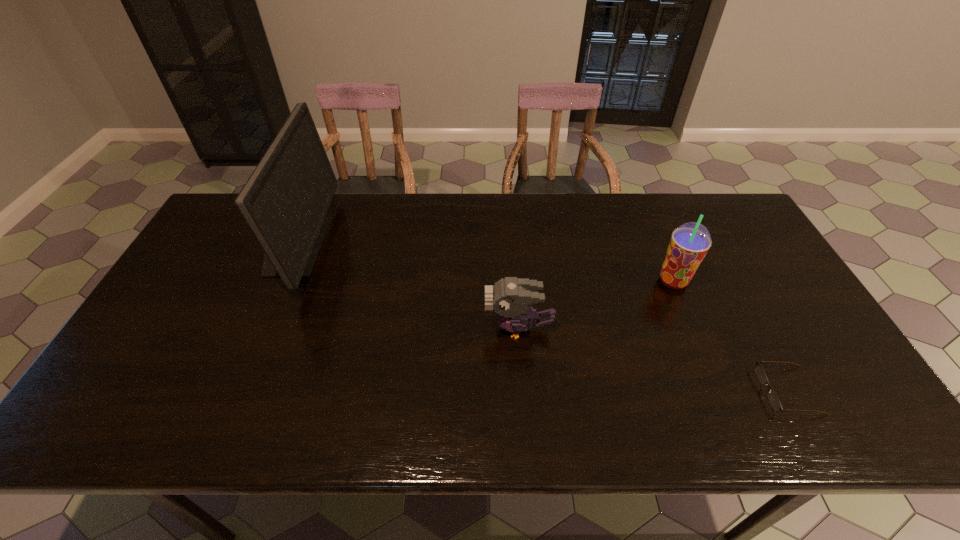
This screenshot has height=540, width=960. What are the coordinates of `free space located 0.210m at the beak of the second object from left to right` in the screenshot? It's located at (404, 329).

At what (x,y) coordinates should I click in order to perform the action: click on free region located at the beak of the second object from left to right. Please return your answer as a coordinate pair (x, y). Image resolution: width=960 pixels, height=540 pixels. Looking at the image, I should click on (396, 329).

Where is `vacant space located 0.070m at the beak of the second object from left to right`? vacant space located 0.070m at the beak of the second object from left to right is located at coordinates (458, 329).

Find the location of a particular element. The width and height of the screenshot is (960, 540). vacant space located 0.220m on the front-facing side of the shortest object is located at coordinates 669,390.

Find the location of a particular element. This screenshot has height=540, width=960. vacant space located on the front-facing side of the shortest object is located at coordinates (643, 390).

The width and height of the screenshot is (960, 540). I want to click on vacant point located 0.200m on the front-facing side of the shortest object, so click(678, 390).

At what (x,y) coordinates should I click in order to perform the action: click on object present at the far edge. Please return your answer as a coordinate pair (x, y). This screenshot has height=540, width=960. Looking at the image, I should click on (285, 201).

Identify the location of object that is positioned at the near edge. This screenshot has height=540, width=960. (759, 371).

You are a GUI agent. You are given a task and a screenshot of the screen. Output one action in this format:
    pyautogui.click(x=<x>, y=<y>)
    Task: Click on the object that is at the right edge
    Image resolution: width=960 pixels, height=540 pixels.
    Given the screenshot: What is the action you would take?
    pyautogui.click(x=759, y=371)

At what (x,y) coordinates should I click in order to perform the action: click on object at the near right corner. Please return your answer as a coordinate pair (x, y). The width and height of the screenshot is (960, 540). Looking at the image, I should click on (759, 371).